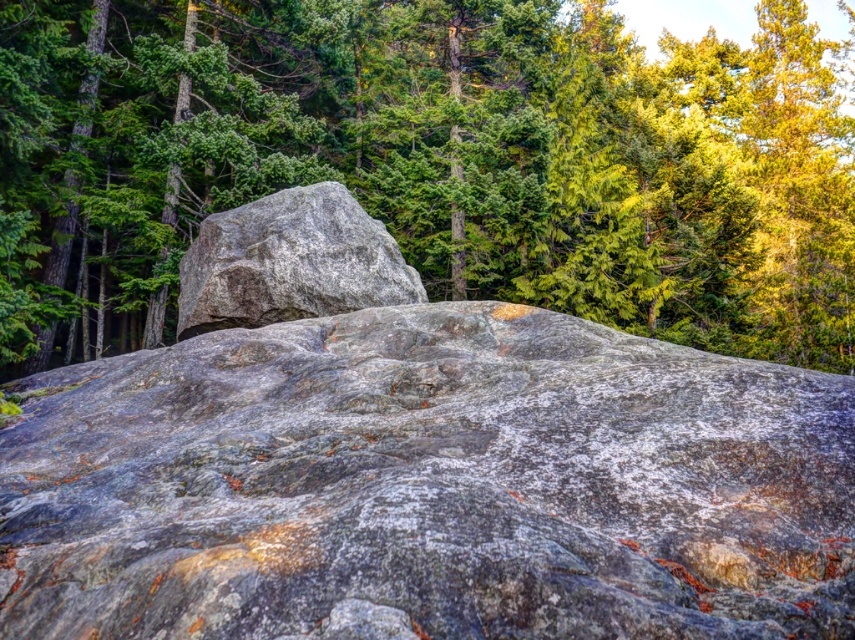
Which is above, gray granite rock at center or gray rough boulder at center?

gray rough boulder at center is above.

Which of these two, gray granite rock at center or gray rough boulder at center, stands taller?

gray rough boulder at center

Who is more distant from viewer, (735, 534) or (387, 240)?

Point (387, 240)

Locate an element on the screen. This screenshot has width=855, height=640. gray granite rock at center is located at coordinates 428,484.

Who is more forward, (555, 228) or (202, 248)?

Point (202, 248)

Who is more distant from viewer, (528, 208) or (335, 262)?

The point (528, 208) is behind.

Find the location of a particular element. The height and width of the screenshot is (640, 855). green textured tree at upper center is located at coordinates (431, 161).

Does gray granite rock at center lie behind green textured tree at upper center?

No, gray granite rock at center is closer to the viewer.

Which is above, gray granite rock at center or green textured tree at upper center?

green textured tree at upper center

The width and height of the screenshot is (855, 640). Find the location of `gray granite rock at center`. gray granite rock at center is located at coordinates (428, 484).